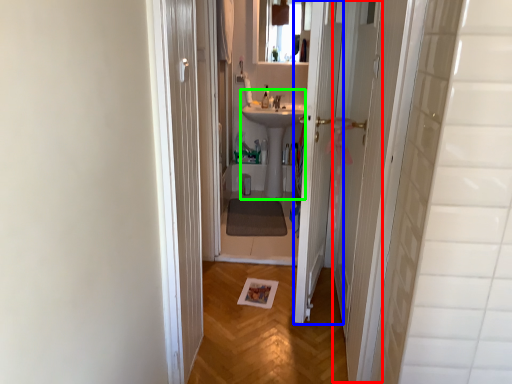
Question: Considering the real-world distances, which object is farthest from screen door (highlighted by a red box)? door (highlighted by a blue box) or sink (highlighted by a green box)?

Choices:
 (A) door
 (B) sink

Answer: (B)